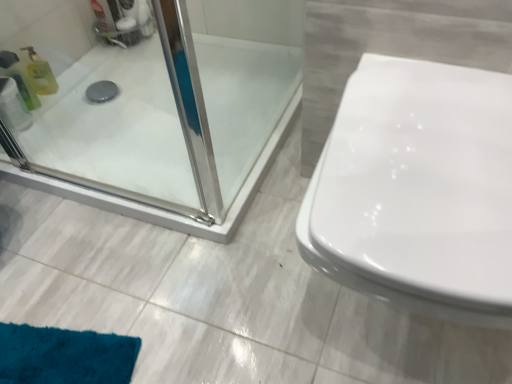
Locate an element on the screen. vacant space in white glossy toilet at right (from a real-world perspective) is located at coordinates (374, 336).